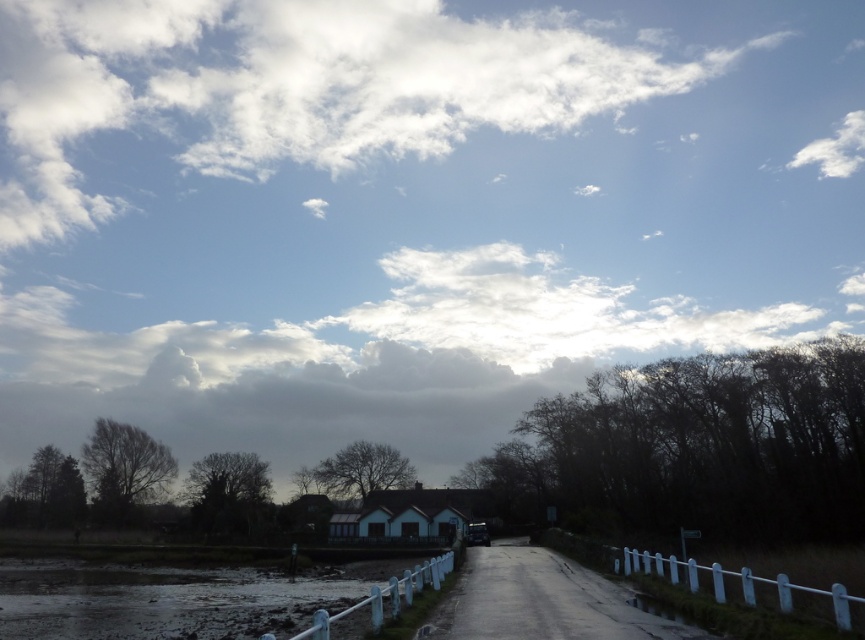
You are planning to take a photo of the white fluffy cloud at upper center and the muddy wet ground at lower left. Which object should you focus on first if you want to capture both in one frame without moving the camera?

You should focus on the white fluffy cloud at upper center first because it is wider than the muddy wet ground at lower left, so it requires a wider angle to capture its full size while still including the smaller muddy wet ground at lower left in the frame.

You are a photographer planning to capture the entire scene in one shot. Given that the muddy wet ground at lower left and the white fluffy cloud at upper center are both in the frame, which object would appear higher in the photograph?

The white fluffy cloud at upper center appears higher in the photograph since it has a greater height compared to the muddy wet ground at lower left.

You are standing at the starting point of the road and want to reach a destination located at point (702, 604). There is an obstacle at point (98, 624). Which point is closer to you, the obstacle or the destination?

The obstacle at point (98, 624) is closer to you than the destination at point (702, 604) because the obstacle is further to the camera, meaning it is physically closer to your position.